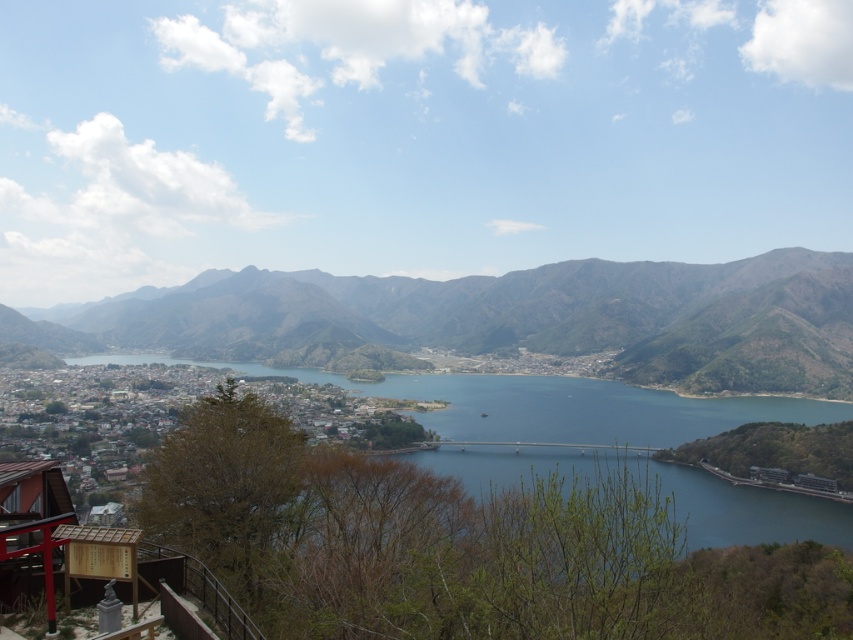
Question: Does brown textured mountains at center have a larger size compared to blue glassy water at center?

Choices:
 (A) yes
 (B) no

Answer: (A)

Question: Which of the following is the closest to the observer?

Choices:
 (A) (x=693, y=269)
 (B) (x=662, y=484)

Answer: (B)

Question: Is brown textured mountains at center thinner than blue glassy water at center?

Choices:
 (A) no
 (B) yes

Answer: (A)

Question: Does brown textured mountains at center appear on the right side of blue glassy water at center?

Choices:
 (A) yes
 (B) no

Answer: (A)

Question: Which point is closer to the camera?

Choices:
 (A) (718, 540)
 (B) (775, 289)

Answer: (A)

Question: Which point is closer to the camera?

Choices:
 (A) (599, 380)
 (B) (408, 304)

Answer: (A)